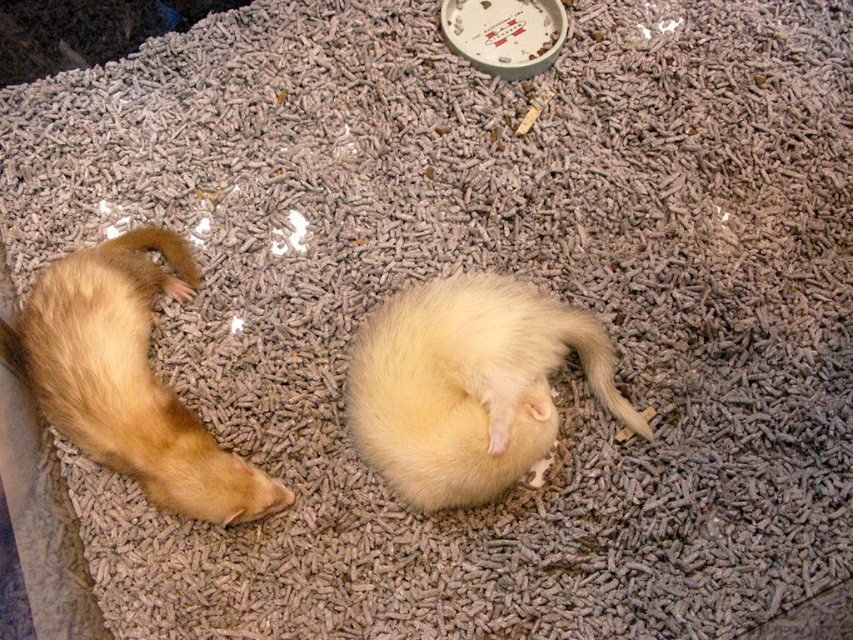
Question: Which of the following is the farthest from the observer?

Choices:
 (A) fluffy white ferret at center
 (B) yellow fur at lower center

Answer: (B)

Question: Can you confirm if fluffy white ferret at center is smaller than golden fur ferret at left?

Choices:
 (A) no
 (B) yes

Answer: (B)

Question: Which point is closer to the camera?

Choices:
 (A) (434, 442)
 (B) (183, 493)
 (C) (560, 326)

Answer: (A)

Question: Does golden fur ferret at left lie behind yellow fur at lower center?

Choices:
 (A) no
 (B) yes

Answer: (A)

Question: Which point is closer to the camera?

Choices:
 (A) fluffy white ferret at center
 (B) golden fur ferret at left

Answer: (A)

Question: Does fluffy white ferret at center have a lesser width compared to yellow fur at lower center?

Choices:
 (A) yes
 (B) no

Answer: (B)